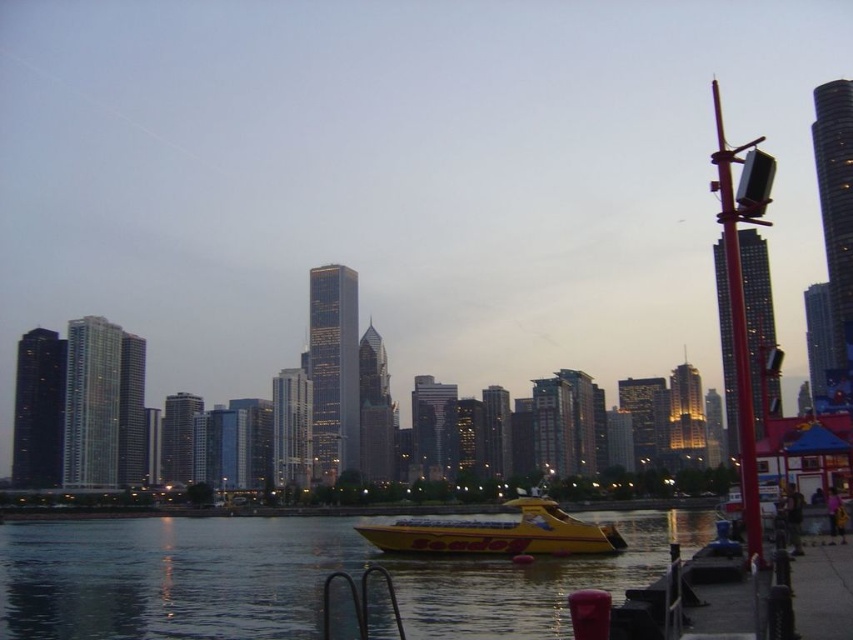
Question: Which point appears closest to the camera in this image?

Choices:
 (A) (33, 529)
 (B) (496, 552)

Answer: (B)

Question: Does transparent water at center appear over yellow matte seadog at center?

Choices:
 (A) yes
 (B) no

Answer: (B)

Question: From the image, what is the correct spatial relationship of transparent water at center in relation to yellow matte seadog at center?

Choices:
 (A) above
 (B) below

Answer: (B)

Question: Can you confirm if transparent water at center is positioned to the right of yellow matte seadog at center?

Choices:
 (A) no
 (B) yes

Answer: (A)